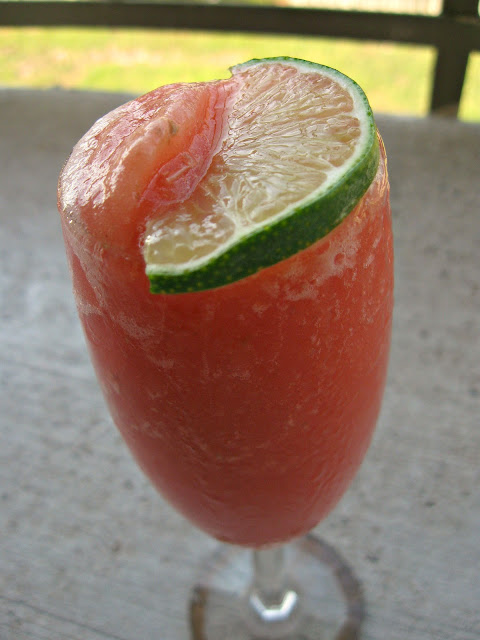
You are a GUI agent. You are given a task and a screenshot of the screen. Output one action in this format:
    pyautogui.click(x=<x>, y=<y>)
    Task: Click on the red drink inside wine glass
    The image size is (480, 640).
    Given the screenshot: What is the action you would take?
    pyautogui.click(x=270, y=507), pyautogui.click(x=130, y=336), pyautogui.click(x=358, y=333), pyautogui.click(x=132, y=164)